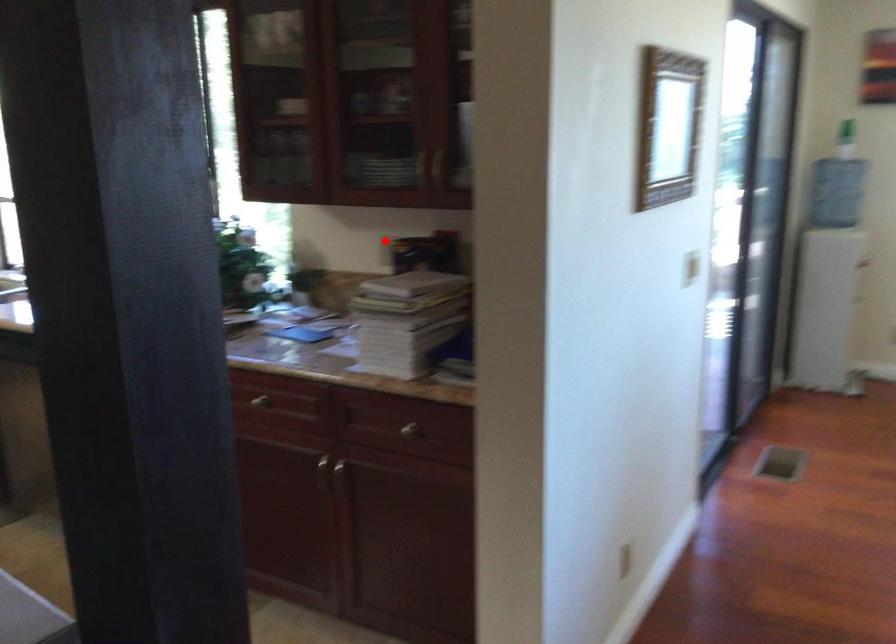
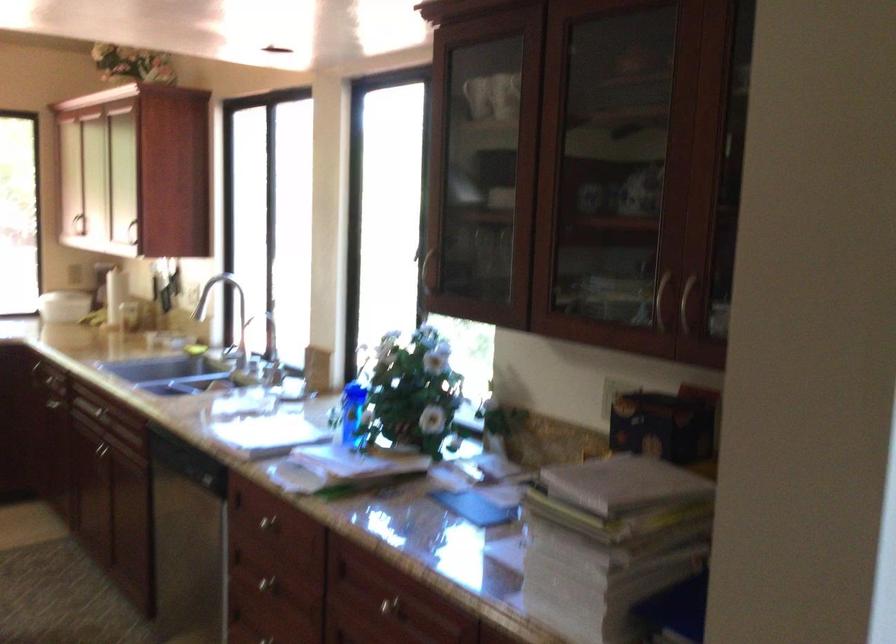
Question: I am providing you with two images of the same scene from different viewpoints. Given a red point in image1, look at the same physical point in image2. Is it:

Choices:
 (A) Closer to the viewpoint
 (B) Farther from the viewpoint

Answer: (A)